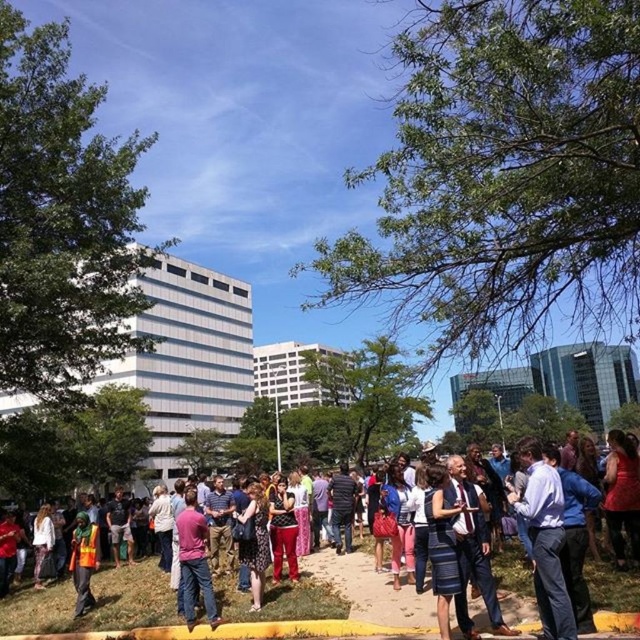
You are standing in the park and see two points marked in the image. The first point is at coordinates point (268, 625) and the second is at point (220, 620). Which point is closer to you?

Point (268, 625) is in front of point (220, 620), so it is closer to you.

You are standing at the entrance of the park and see the pink fabric shirt at center. Which direction should you walk to reach it?

The pink fabric shirt at center is located at point (195,561), so you should walk towards the center of the park to reach it.

You are a photographer standing at the edge of the park, holding a camera. You want to capture a candid shot of a person wearing blue denim jeans at center without them noticing. The camera has a maximum focus range of 18 feet. Can you take the photo from your current position?

The blue denim jeans at center and camera are 17.66 feet apart. Since the distance is within the camera maximum focus range of 18 feet, you can take the photo from your current position.